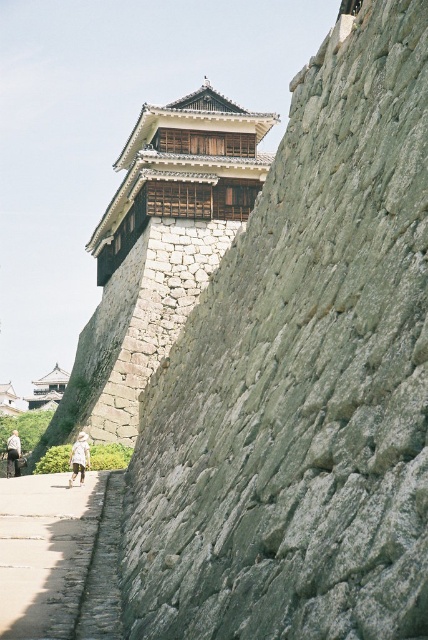
Question: Does gray rough stone wall at upper left appear on the right side of smooth concrete path at center?

Choices:
 (A) no
 (B) yes

Answer: (B)

Question: Which object is closer to the camera taking this photo?

Choices:
 (A) light beige cotton shirt at center
 (B) gray rough stone wall at upper left
 (C) smooth concrete path at center
 (D) white cotton shirt at lower left

Answer: (B)

Question: Which point appears farthest from the camera in this image?

Choices:
 (A) (321, 417)
 (B) (77, 445)
 (C) (11, 579)

Answer: (B)

Question: Estimate the real-world distances between objects in this image. Which object is closer to the white cotton shirt at lower left?

Choices:
 (A) gray rough stone wall at upper left
 (B) smooth concrete path at center
 (C) light beige cotton shirt at center

Answer: (C)

Question: From the image, what is the correct spatial relationship of smooth concrete path at center in relation to light beige cotton shirt at center?

Choices:
 (A) right
 (B) left

Answer: (A)

Question: Does smooth concrete path at center have a larger size compared to light beige cotton shirt at center?

Choices:
 (A) no
 (B) yes

Answer: (B)